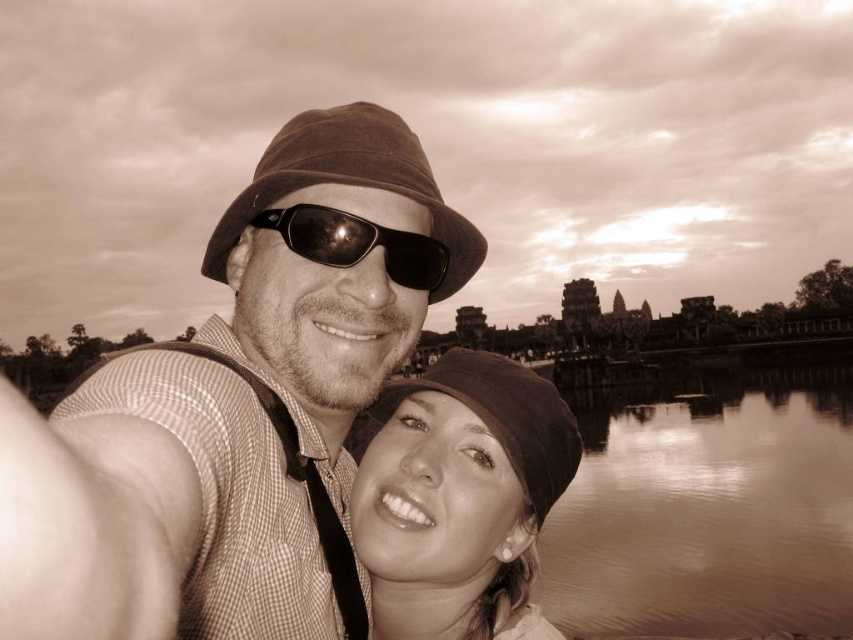
You are taking a selfie with two friends in a scenic location. You notice two points marked on your camera screen at coordinates point (844, 538) and point (405, 506). Which point is closer to the camera?

Point (844, 538) is further to the camera than point (405, 506), so the point closer to the camera is point (405, 506).